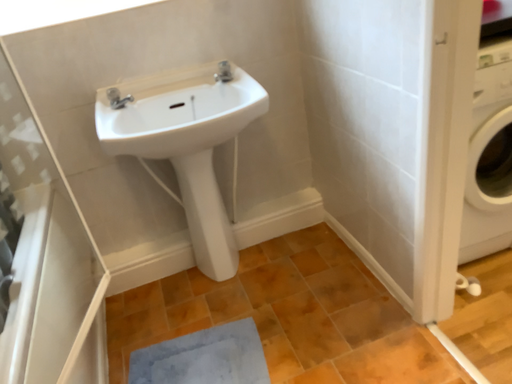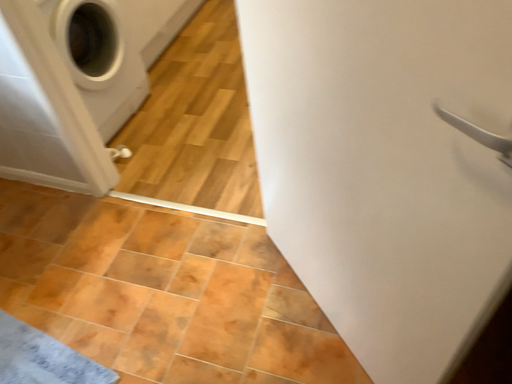
Question: How did the camera likely rotate when shooting the video?

Choices:
 (A) rotated right
 (B) rotated left

Answer: (A)